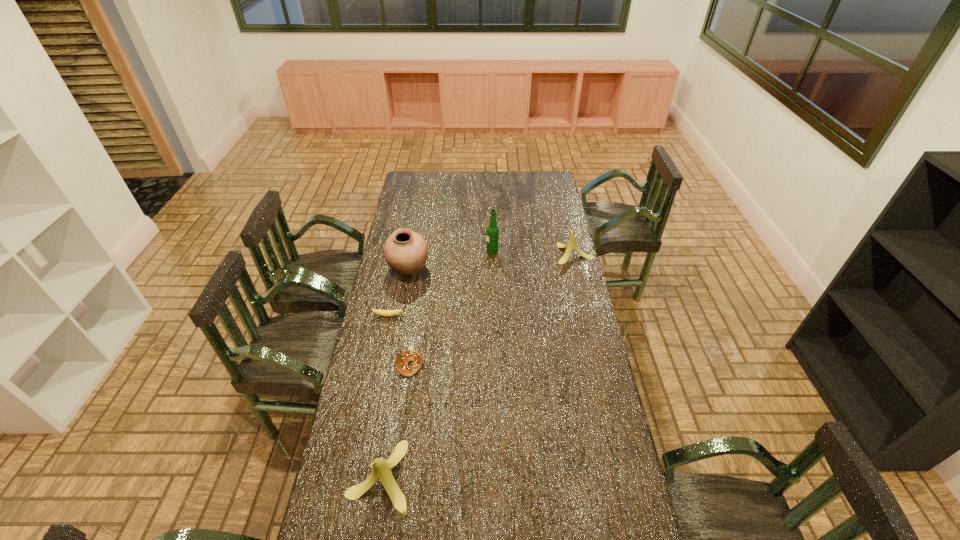
To ensure equal spacing by inserting another banana among them, please point out a vacant spot for this new banana. Please provide its 2D coordinates. Your answer should be formatted as a tuple, i.e. [(x, y)], where the tuple contains the x and y coordinates of a point satisfying the conditions above.

[(498, 340)]